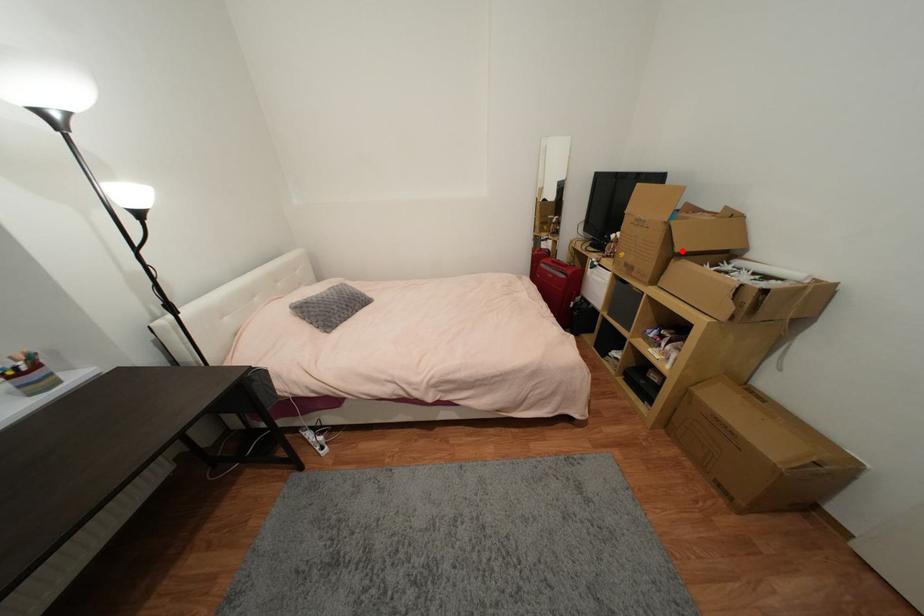
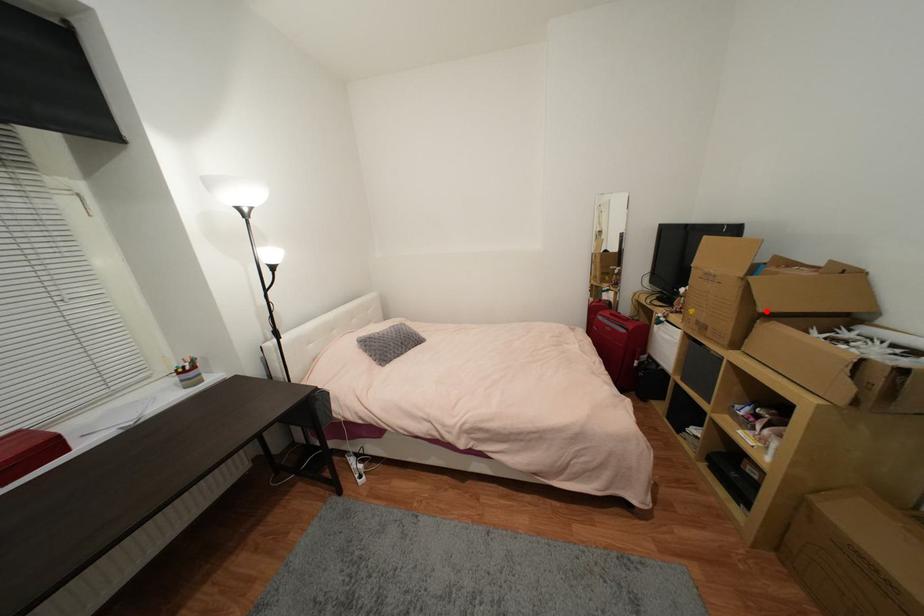
I am providing you with two images of the same scene from different viewpoints. A red point is marked on the first image and another point is marked on the second image. Are the points marked in image1 and image2 representing the same 3D position?

Yes